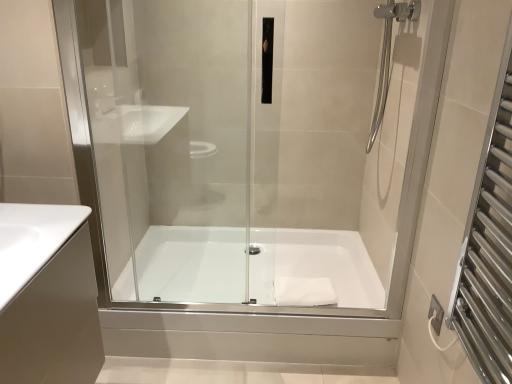
Question: Is transparent glass shower door at center closer to the viewer compared to silver metallic towel rack at right?

Choices:
 (A) no
 (B) yes

Answer: (A)

Question: Are transparent glass shower door at center and silver metallic towel rack at right beside each other?

Choices:
 (A) yes
 (B) no

Answer: (B)

Question: From a real-world perspective, is transparent glass shower door at center over silver metallic towel rack at right?

Choices:
 (A) yes
 (B) no

Answer: (B)

Question: Is transparent glass shower door at center thinner than silver metallic towel rack at right?

Choices:
 (A) yes
 (B) no

Answer: (A)

Question: Can you confirm if transparent glass shower door at center is shorter than silver metallic towel rack at right?

Choices:
 (A) no
 (B) yes

Answer: (A)

Question: Based on their sizes in the image, would you say white matte towel at center is bigger or smaller than transparent glass shower door at center?

Choices:
 (A) small
 (B) big

Answer: (A)

Question: Considering the positions of white matte towel at center and transparent glass shower door at center in the image, is white matte towel at center taller or shorter than transparent glass shower door at center?

Choices:
 (A) short
 (B) tall

Answer: (A)

Question: From the image's perspective, is white matte towel at center positioned above or below transparent glass shower door at center?

Choices:
 (A) above
 (B) below

Answer: (B)

Question: Is point (295, 296) positioned closer to the camera than point (399, 243)?

Choices:
 (A) closer
 (B) farther

Answer: (B)

Question: Considering the relative positions of white glossy sink at lower left and transparent glass shower door at center in the image provided, is white glossy sink at lower left to the left or to the right of transparent glass shower door at center?

Choices:
 (A) left
 (B) right

Answer: (A)

Question: Looking at the image, does white glossy sink at lower left seem bigger or smaller compared to transparent glass shower door at center?

Choices:
 (A) small
 (B) big

Answer: (A)

Question: From a real-world perspective, is white glossy sink at lower left positioned above or below transparent glass shower door at center?

Choices:
 (A) above
 (B) below

Answer: (B)

Question: Is white glossy sink at lower left inside or outside of transparent glass shower door at center?

Choices:
 (A) inside
 (B) outside

Answer: (B)

Question: From a real-world perspective, is white glossy sink at lower left above or below silver metallic towel rack at right?

Choices:
 (A) below
 (B) above

Answer: (A)

Question: Considering the positions of white glossy sink at lower left and silver metallic towel rack at right in the image, is white glossy sink at lower left wider or thinner than silver metallic towel rack at right?

Choices:
 (A) thin
 (B) wide

Answer: (B)